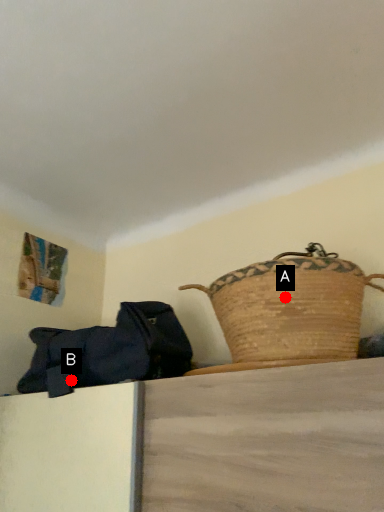
Question: Two points are circled on the image, labeled by A and B beside each circle. Which point is closer to the camera?

Choices:
 (A) A is closer
 (B) B is closer

Answer: (A)